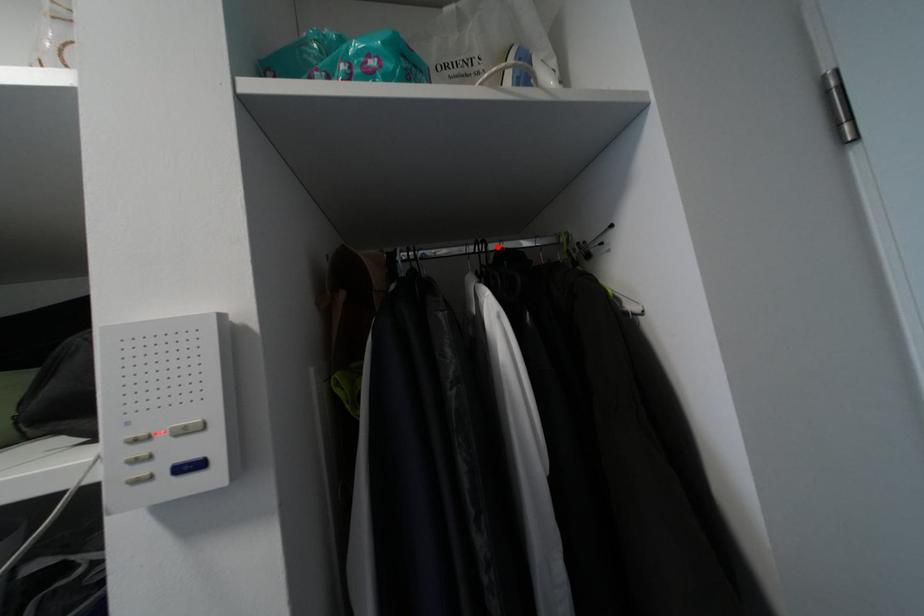
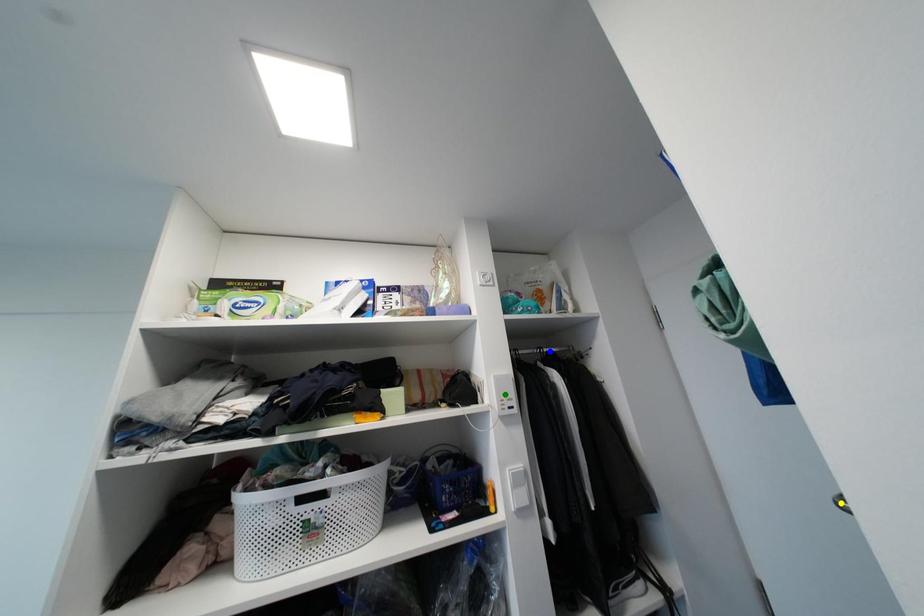
Question: I am providing you with two images of the same scene from different viewpoints. A red point is marked on the first image. You are given multiple points on the second image. Which point in image 2 is actually the same real-world point as the red point in image 1?

Choices:
 (A) yellow point
 (B) blue point
 (C) green point

Answer: (B)